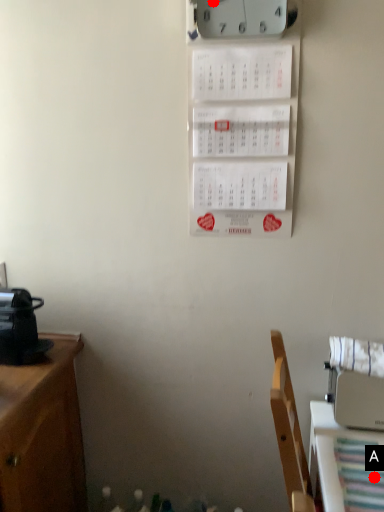
Question: Two points are circled on the image, labeled by A and B beside each circle. Among these points, which one is nearest to the camera?

Choices:
 (A) A is closer
 (B) B is closer

Answer: (A)